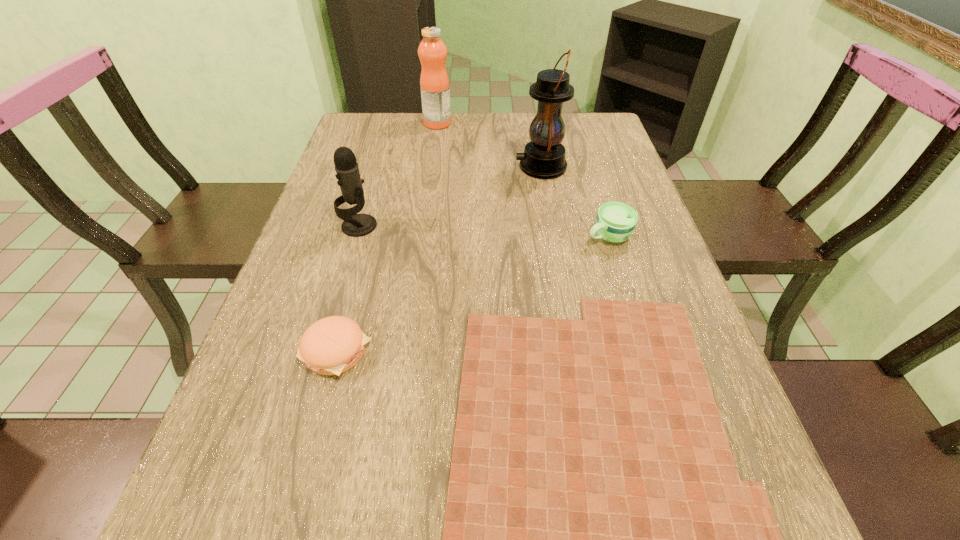
The height and width of the screenshot is (540, 960). I want to click on free spot located 0.250m on the front of the third tallest object, so click(x=332, y=318).

The image size is (960, 540). Find the location of `free space located 0.400m on the left of the third shortest object`. free space located 0.400m on the left of the third shortest object is located at coordinates (419, 236).

What are the coordinates of `blank area located 0.120m on the right of the second shortest object` in the screenshot? It's located at (435, 352).

Find the location of a particular element. object situated at the far edge is located at coordinates (434, 83).

At what (x,y) coordinates should I click in order to perform the action: click on microphone located in the left edge section of the desktop. Please return your answer as a coordinate pair (x, y). This screenshot has width=960, height=540. Looking at the image, I should click on (347, 169).

Locate an element on the screen. The image size is (960, 540). patty at the left edge is located at coordinates (330, 346).

Locate an element on the screen. object that is at the right edge is located at coordinates pyautogui.click(x=615, y=222).

The image size is (960, 540). What are the coordinates of `vacant space at the far edge of the desktop` in the screenshot? It's located at (452, 116).

The width and height of the screenshot is (960, 540). I want to click on free space at the near edge of the desktop, so click(x=439, y=524).

Locate an element on the screen. This screenshot has height=540, width=960. vacant space at the left edge of the desktop is located at coordinates (332, 179).